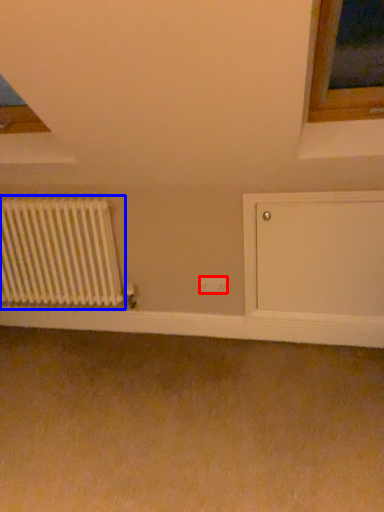
Question: Which object is further to the camera taking this photo, electric outlet (highlighted by a red box) or radiator (highlighted by a blue box)?

Choices:
 (A) electric outlet
 (B) radiator

Answer: (A)